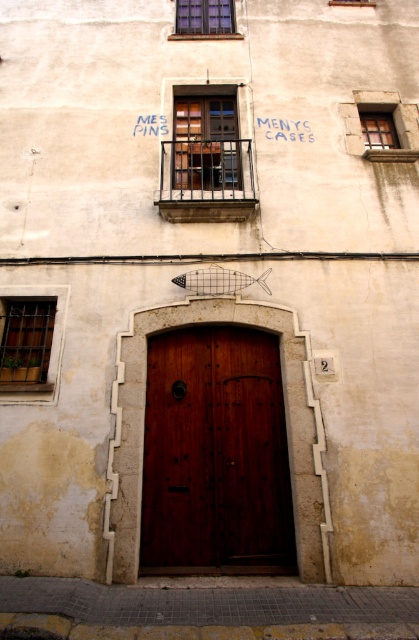
Question: Can you confirm if matte metal window at upper center is positioned below blue glass window at upper center?

Choices:
 (A) yes
 (B) no

Answer: (A)

Question: Which of the following is the farthest from the observer?

Choices:
 (A) blue glass window at upper center
 (B) matte metal window at upper center
 (C) blue painted text at upper center

Answer: (A)

Question: Observing the image, what is the correct spatial positioning of metallic grid window at lower left in reference to blue painted text at upper center?

Choices:
 (A) below
 (B) above

Answer: (A)

Question: Based on their relative distances, which object is nearer to the polished wood door at center?

Choices:
 (A) clear glass window at upper center
 (B) blue glass window at upper center

Answer: (B)

Question: Is metallic grid window at lower left wider than wooden at upper right?

Choices:
 (A) no
 (B) yes

Answer: (B)

Question: Which of the following is the closest to the observer?

Choices:
 (A) (175, 470)
 (B) (152, 124)
 (C) (392, 124)

Answer: (A)